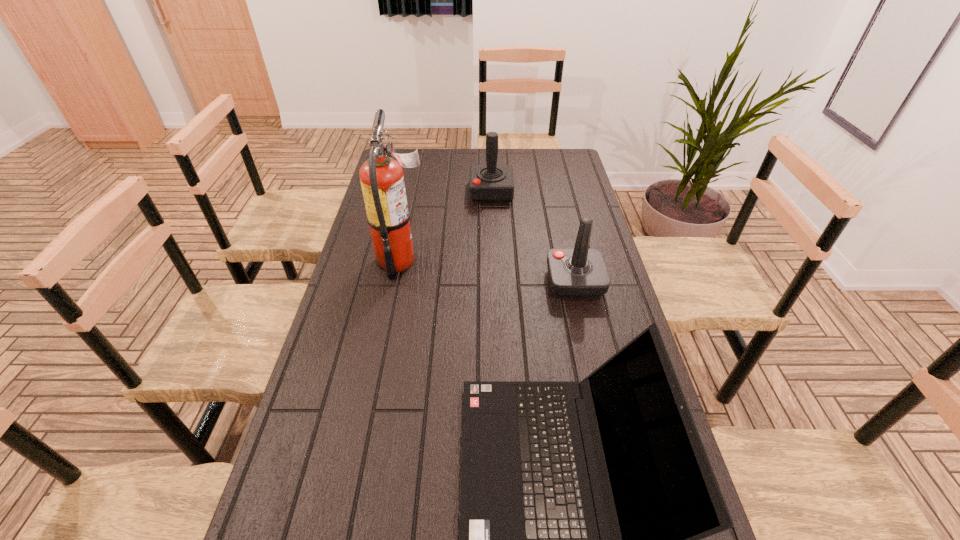
Identify the location of fire extinguisher. This screenshot has height=540, width=960. (382, 181).

You are a GUI agent. You are given a task and a screenshot of the screen. Output one action in this format:
    pyautogui.click(x=<x>, y=<y>)
    Task: Click on the leftmost object
    The image size is (960, 540).
    Given the screenshot: What is the action you would take?
    pyautogui.click(x=382, y=181)

Where is `the left joystick`? This screenshot has width=960, height=540. the left joystick is located at coordinates [488, 183].

Locate an element on the screen. the farther joystick is located at coordinates (488, 183).

At what (x,y) coordinates should I click in order to perform the action: click on the nearer joystick. Please return your answer as a coordinate pair (x, y). This screenshot has width=960, height=540. Looking at the image, I should click on (575, 273).

Identify the location of free space located from the nozzle of the tallest object. The height and width of the screenshot is (540, 960). (511, 260).

The width and height of the screenshot is (960, 540). In order to click on blank area located on the base of the farther joystick in this screenshot , I will do `click(423, 192)`.

I want to click on free space located 0.360m on the base of the farther joystick, so click(382, 192).

Identify the location of vacant point located on the base of the farther joystick. This screenshot has width=960, height=540. (382, 192).

I want to click on vacant space situated on the front of the nearer joystick, so click(x=592, y=362).